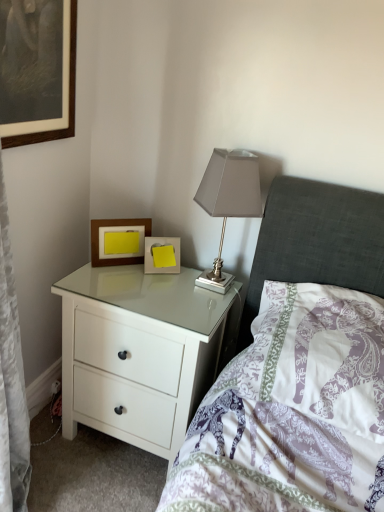
At what (x,y) coordinates should I click in order to perform the action: click on vacant area that is situated to the right of wooden picture frame at upper left, which is the second picture frame from bottom to top. Please return your answer as a coordinate pair (x, y). The image size is (384, 512). Looking at the image, I should click on (162, 276).